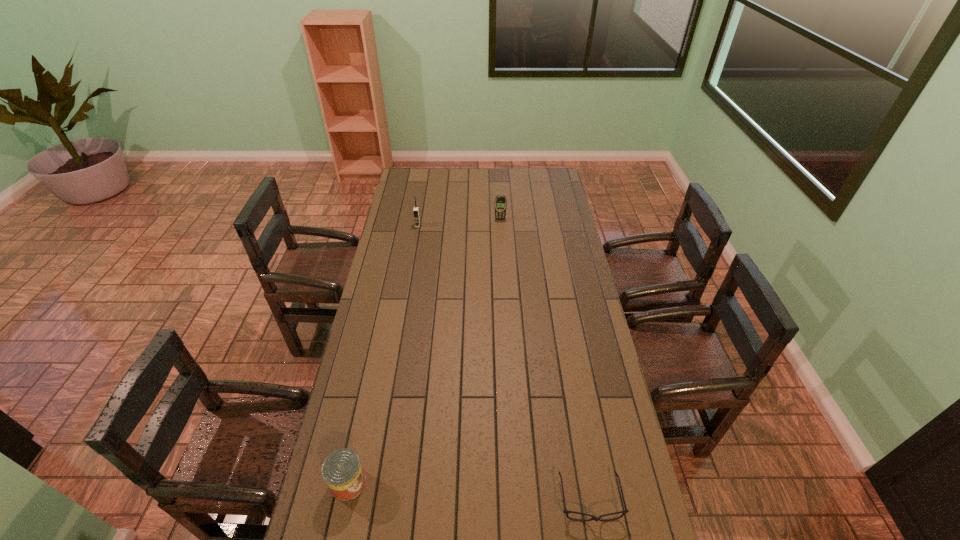
Identify the location of free space that is in between the can and the shortest object. Image resolution: width=960 pixels, height=540 pixels. (469, 491).

Find the location of `free area in between the taller cellular telephone and the shortest object`. free area in between the taller cellular telephone and the shortest object is located at coordinates (504, 362).

Where is `unoccupied position between the second shortest object and the farther cellular telephone`? The height and width of the screenshot is (540, 960). unoccupied position between the second shortest object and the farther cellular telephone is located at coordinates (424, 351).

The width and height of the screenshot is (960, 540). Identify the location of free spot between the can and the second farthest object. (383, 354).

This screenshot has width=960, height=540. What are the coordinates of `vacant area between the shortest object and the second shortest object` in the screenshot? It's located at (469, 491).

Image resolution: width=960 pixels, height=540 pixels. What are the coordinates of `vacant region between the leftmost object and the shorter cellular telephone` in the screenshot? It's located at (424, 351).

Where is `free area in between the third object from right to left and the rightmost object`? The width and height of the screenshot is (960, 540). free area in between the third object from right to left and the rightmost object is located at coordinates (504, 362).

You are a GUI agent. You are given a task and a screenshot of the screen. Output one action in this format:
    pyautogui.click(x=<x>, y=<y>)
    Task: Click on the vacant area that lies between the third shortest object and the leftmost object
    The height and width of the screenshot is (540, 960).
    Given the screenshot: What is the action you would take?
    pyautogui.click(x=424, y=351)

Where is `free spot between the spectacles and the taller cellular telephone`? free spot between the spectacles and the taller cellular telephone is located at coordinates (504, 362).

I want to click on object identified as the third closest to the second object from right to left, so click(x=342, y=471).